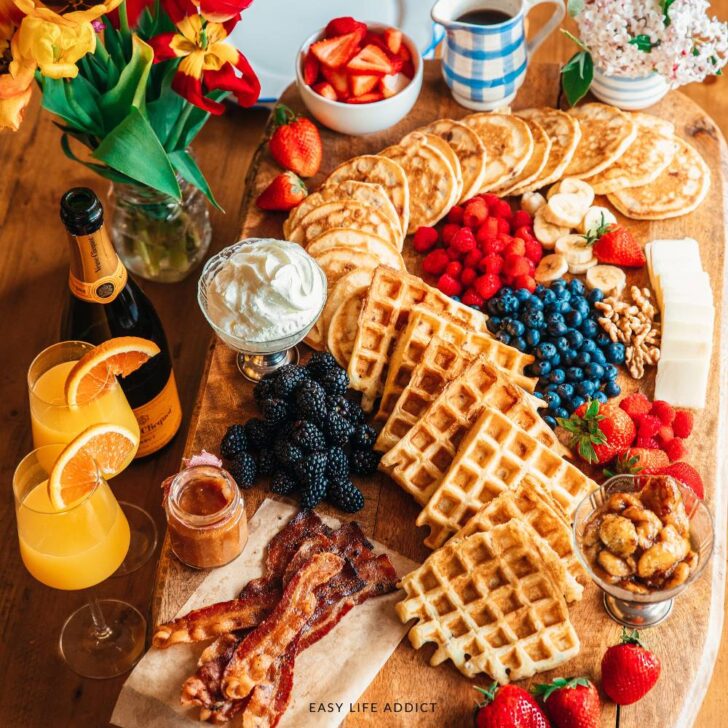
Find the location of a particular element. bottle is located at coordinates (130, 312).